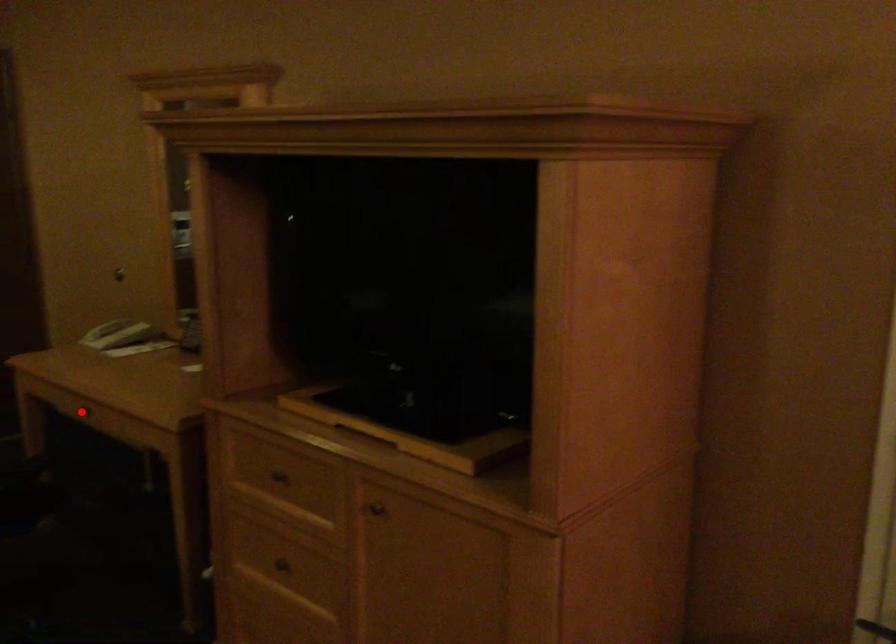
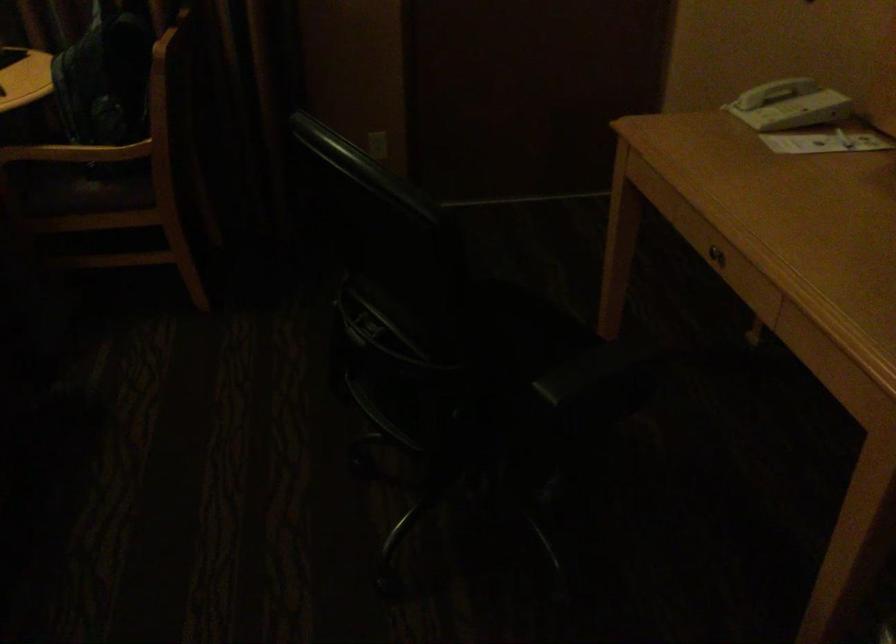
Where in the second image is the point corresponding to the highlighted location from the first image?

(714, 257)